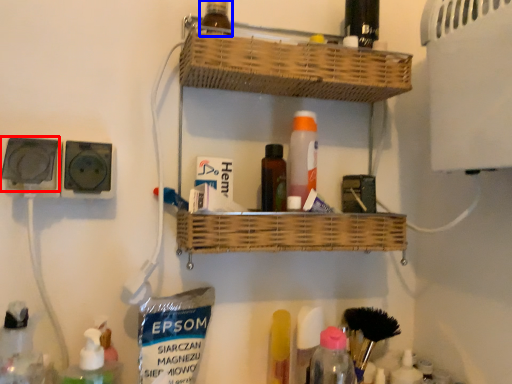
Question: Which object appears farthest to the camera in this image, electric outlet (highlighted by a red box) or bottle (highlighted by a blue box)?

Choices:
 (A) electric outlet
 (B) bottle

Answer: (B)